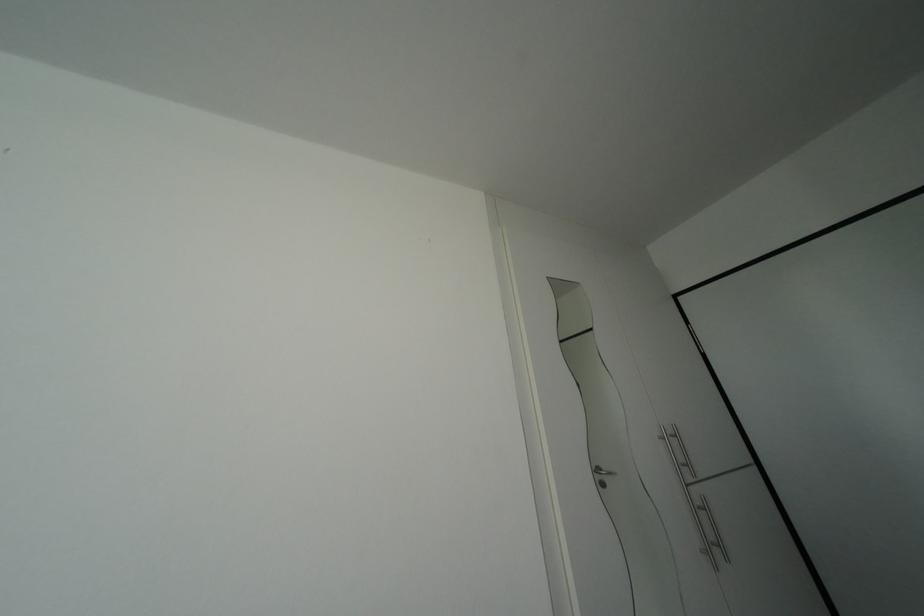
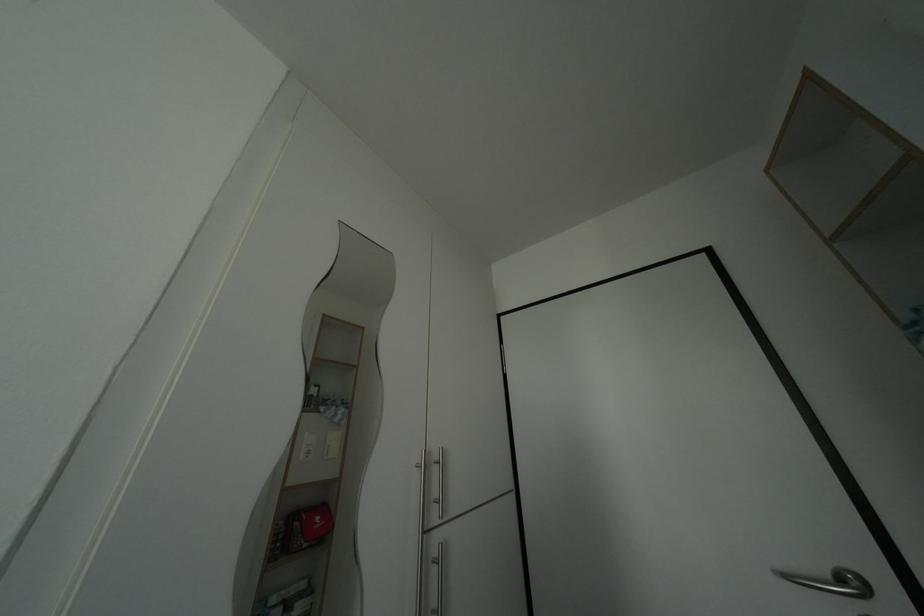
Locate, in the second image, the point that corresponds to [711,519] in the first image.

(442, 576)